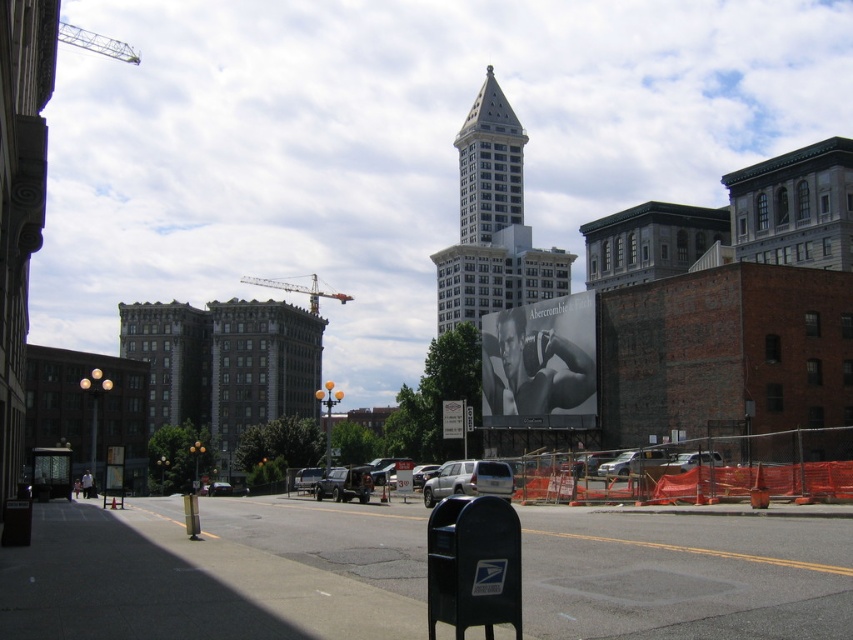
How much distance is there between black and white photograph at center and white glass tower at center?

black and white photograph at center and white glass tower at center are 112.35 meters apart.

This screenshot has height=640, width=853. Describe the element at coordinates (540, 364) in the screenshot. I see `black and white photograph at center` at that location.

Between point (512, 352) and point (491, 166), which one is positioned in front?

Point (512, 352) is more forward.

This screenshot has height=640, width=853. I want to click on black and white photograph at center, so click(x=540, y=364).

Locate an element on the screen. The height and width of the screenshot is (640, 853). orange mesh fence at center is located at coordinates (218, 572).

Looking at this image, between orange mesh fence at center and white stone tower at center, which one appears on the left side from the viewer's perspective?

From the viewer's perspective, orange mesh fence at center appears more on the left side.

This screenshot has width=853, height=640. Describe the element at coordinates (218, 572) in the screenshot. I see `orange mesh fence at center` at that location.

Where is `orange mesh fence at center`? This screenshot has height=640, width=853. orange mesh fence at center is located at coordinates (218, 572).

Where is `black and white photograph at center`? black and white photograph at center is located at coordinates (540, 364).

Is black and white photograph at center to the right of metallic construction crane at center from the viewer's perspective?

Correct, you'll find black and white photograph at center to the right of metallic construction crane at center.

Is point (505, 348) farther from camera compared to point (315, 289)?

No, it is not.

Identify the location of black and white photograph at center. This screenshot has height=640, width=853. (540, 364).